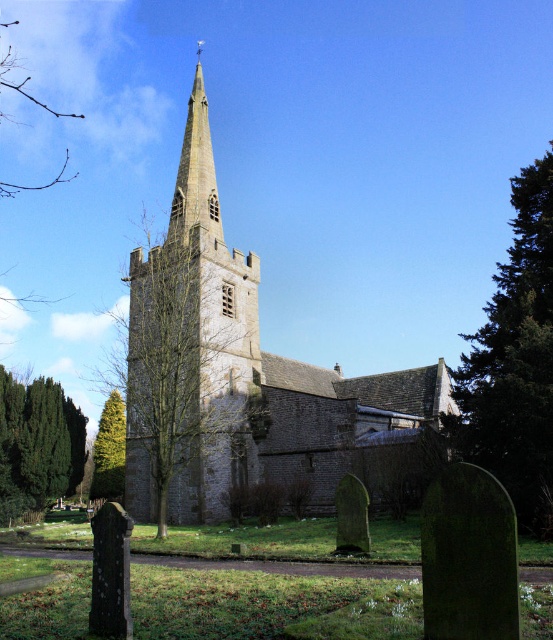
Question: Does gray stone church at center appear on the left side of green textured tree at lower left?

Choices:
 (A) no
 (B) yes

Answer: (A)

Question: Which point is farther to the camera?

Choices:
 (A) (153, 284)
 (B) (59, 435)

Answer: (B)

Question: Considering the relative positions of gray stone church at center and green leafy tree at right in the image provided, where is gray stone church at center located with respect to green leafy tree at right?

Choices:
 (A) below
 (B) above

Answer: (A)

Question: Among these points, which one is nearest to the camera?

Choices:
 (A) (185, 196)
 (B) (51, 420)

Answer: (B)

Question: Which of the following is the closest to the observer?

Choices:
 (A) (502, 305)
 (B) (143, 470)
 (C) (181, 250)
 (D) (44, 493)

Answer: (A)

Question: In this image, where is green leafy tree at center located relative to green leafy tree at right?

Choices:
 (A) right
 (B) left

Answer: (B)